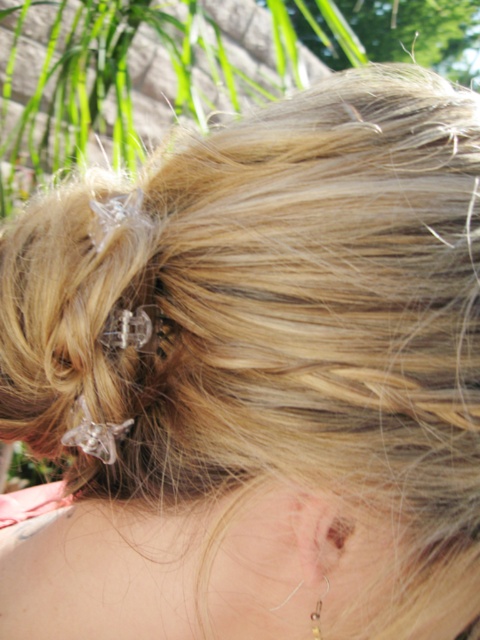
Question: Which point is closer to the camera?

Choices:
 (A) (319, 598)
 (B) (325, 516)

Answer: (B)

Question: Is pale skin ear at lower center further to camera compared to gold metallic earring at lower center?

Choices:
 (A) no
 (B) yes

Answer: (A)

Question: Does pale skin ear at lower center have a larger size compared to gold metallic earring at lower center?

Choices:
 (A) yes
 (B) no

Answer: (A)

Question: Can you confirm if pale skin ear at lower center is positioned above gold metallic earring at lower center?

Choices:
 (A) no
 (B) yes

Answer: (B)

Question: Which point is closer to the camera?

Choices:
 (A) gold metallic earring at lower center
 (B) pale skin ear at lower center

Answer: (B)

Question: Which point is farther to the camera?

Choices:
 (A) (319, 621)
 (B) (302, 538)

Answer: (A)